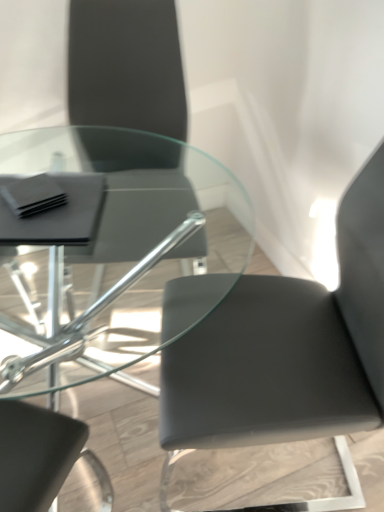
The width and height of the screenshot is (384, 512). What do you see at coordinates (288, 347) in the screenshot?
I see `matte black chair at center, the second chair viewed from the left` at bounding box center [288, 347].

This screenshot has height=512, width=384. What are the coordinates of `matte black chair at center, the second chair viewed from the left` in the screenshot? It's located at (288, 347).

Locate an element on the screen. This screenshot has width=384, height=512. matte black chair at upper left, which appears as the 2th chair when viewed from the right is located at coordinates (102, 183).

What do you see at coordinates (102, 183) in the screenshot? I see `matte black chair at upper left, arranged as the first chair when viewed from the left` at bounding box center [102, 183].

Identify the location of matte black chair at center, the second chair viewed from the left. [288, 347].

Considering the relative positions of matte black chair at center, the second chair viewed from the left, and matte black chair at upper left, arranged as the first chair when viewed from the left, in the image provided, is matte black chair at center, the second chair viewed from the left, to the right of matte black chair at upper left, arranged as the first chair when viewed from the left, from the viewer's perspective?

Correct, you'll find matte black chair at center, the second chair viewed from the left, to the right of matte black chair at upper left, arranged as the first chair when viewed from the left.

Is the depth of matte black chair at center, the second chair viewed from the left, greater than that of matte black chair at upper left, which appears as the 2th chair when viewed from the right?

No, matte black chair at center, the second chair viewed from the left, is closer to the viewer.

Between point (330, 393) and point (4, 367), which one is positioned in front?

The point (330, 393) is in front.

From the image's perspective, does matte black chair at center, the 1th chair from the right, appear higher than matte black chair at upper left, which appears as the 2th chair when viewed from the right?

No, from the image's perspective, matte black chair at center, the 1th chair from the right, is not over matte black chair at upper left, which appears as the 2th chair when viewed from the right.

In the scene shown: From a real-world perspective, which is physically below, matte black chair at center, the second chair viewed from the left, or matte black chair at upper left, arranged as the first chair when viewed from the left?

In real-world perspective, matte black chair at center, the second chair viewed from the left, is lower.

Looking at their sizes, would you say matte black chair at center, the second chair viewed from the left, is wider or thinner than matte black chair at upper left, arranged as the first chair when viewed from the left?

matte black chair at center, the second chair viewed from the left, is wider than matte black chair at upper left, arranged as the first chair when viewed from the left.

Who is taller, matte black chair at center, the 1th chair from the right, or matte black chair at upper left, arranged as the first chair when viewed from the left?

With more height is matte black chair at center, the 1th chair from the right.

Is matte black chair at center, the second chair viewed from the left, bigger or smaller than matte black chair at upper left, which appears as the 2th chair when viewed from the right?

In the image, matte black chair at center, the second chair viewed from the left, appears to be larger than matte black chair at upper left, which appears as the 2th chair when viewed from the right.

Could matte black chair at upper left, arranged as the first chair when viewed from the left, be considered to be inside matte black chair at center, the 1th chair from the right?

No, matte black chair at upper left, arranged as the first chair when viewed from the left, is not surrounded by matte black chair at center, the 1th chair from the right.

Would you consider matte black chair at center, the 1th chair from the right, to be distant from matte black chair at upper left, arranged as the first chair when viewed from the left?

No.

Does matte black chair at center, the 1th chair from the right, turn towards matte black chair at upper left, which appears as the 2th chair when viewed from the right?

No.

Where is `chair lying on the left of matte black chair at center, the second chair viewed from the left`? chair lying on the left of matte black chair at center, the second chair viewed from the left is located at coordinates (102, 183).

In the scene shown: Between matte black chair at upper left, which appears as the 2th chair when viewed from the right, and matte black chair at center, the second chair viewed from the left, which one appears on the left side from the viewer's perspective?

matte black chair at upper left, which appears as the 2th chair when viewed from the right.

Between matte black chair at upper left, arranged as the first chair when viewed from the left, and matte black chair at center, the second chair viewed from the left, which one is positioned in front?

matte black chair at center, the second chair viewed from the left, is more forward.

Which is less distant, (7, 173) or (169, 408)?

Point (7, 173) is farther from the camera than point (169, 408).

From the image's perspective, which one is positioned higher, matte black chair at upper left, arranged as the first chair when viewed from the left, or matte black chair at center, the 1th chair from the right?

matte black chair at upper left, arranged as the first chair when viewed from the left, is shown above in the image.

From a real-world perspective, between matte black chair at upper left, which appears as the 2th chair when viewed from the right, and matte black chair at center, the second chair viewed from the left, who is vertically higher?

matte black chair at upper left, which appears as the 2th chair when viewed from the right, is physically above.

Which of these two, matte black chair at upper left, arranged as the first chair when viewed from the left, or matte black chair at center, the 1th chair from the right, is thinner?

matte black chair at upper left, arranged as the first chair when viewed from the left, is thinner.

Based on the photo, who is taller, matte black chair at upper left, arranged as the first chair when viewed from the left, or matte black chair at center, the second chair viewed from the left?

matte black chair at center, the second chair viewed from the left.

Which of these two, matte black chair at upper left, arranged as the first chair when viewed from the left, or matte black chair at center, the second chair viewed from the left, is smaller?

Smaller between the two is matte black chair at upper left, arranged as the first chair when viewed from the left.

Is matte black chair at upper left, arranged as the first chair when viewed from the left, completely or partially outside of matte black chair at center, the second chair viewed from the left?

Yes.

Is matte black chair at upper left, which appears as the 2th chair when viewed from the right, with matte black chair at center, the second chair viewed from the left?

No, matte black chair at upper left, which appears as the 2th chair when viewed from the right, is not touching matte black chair at center, the second chair viewed from the left.

Is matte black chair at upper left, which appears as the 2th chair when viewed from the right, facing towards matte black chair at center, the second chair viewed from the left?

No, matte black chair at upper left, which appears as the 2th chair when viewed from the right, does not turn towards matte black chair at center, the second chair viewed from the left.

At what (x,y) coordinates should I click in order to perform the action: click on chair in front of the matte black chair at upper left, which appears as the 2th chair when viewed from the right. Please return your answer as a coordinate pair (x, y). Looking at the image, I should click on (288, 347).

Identify the location of chair located above the matte black chair at center, the second chair viewed from the left (from a real-world perspective). (102, 183).

Locate an element on the screen. chair below the matte black chair at upper left, arranged as the first chair when viewed from the left (from a real-world perspective) is located at coordinates (288, 347).